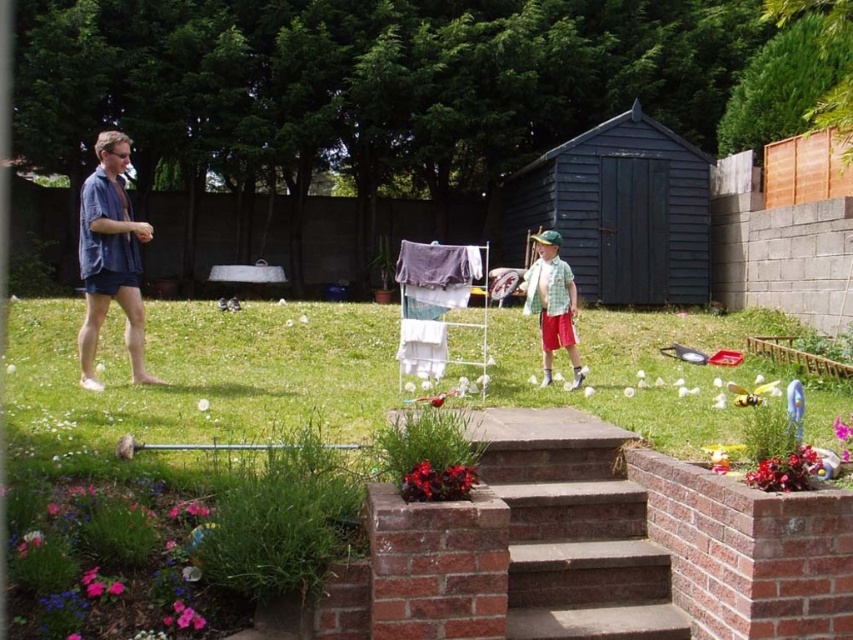
Is brown concrete stairs at center closer to the viewer compared to blue cotton shorts at left?

That is True.

The width and height of the screenshot is (853, 640). What do you see at coordinates (578, 544) in the screenshot?
I see `brown concrete stairs at center` at bounding box center [578, 544].

Where is `brown concrete stairs at center`? The height and width of the screenshot is (640, 853). brown concrete stairs at center is located at coordinates (578, 544).

Can you confirm if brick planter at lower center is positioned to the left of blue cotton shorts at left?

Incorrect, brick planter at lower center is not on the left side of blue cotton shorts at left.

Between brick planter at lower center and blue cotton shorts at left, which one has more height?

blue cotton shorts at left

Identify the location of brick planter at lower center. (196, 378).

Image resolution: width=853 pixels, height=640 pixels. Identify the location of brick planter at lower center. (196, 378).

Between brown concrete stairs at center and checkered fabric shirt at center, which one appears on the right side from the viewer's perspective?

checkered fabric shirt at center is more to the right.

Is brown concrete stairs at center positioned in front of checkered fabric shirt at center?

Yes.

What do you see at coordinates (578, 544) in the screenshot?
I see `brown concrete stairs at center` at bounding box center [578, 544].

Where is `brown concrete stairs at center`? Image resolution: width=853 pixels, height=640 pixels. brown concrete stairs at center is located at coordinates (578, 544).